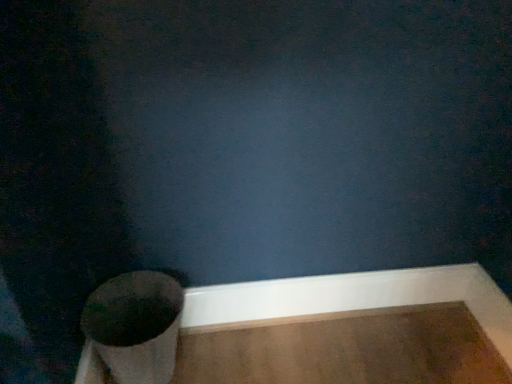
What is the approximate height of white smooth baseboard at lower right?

It is 5.93 inches.

The width and height of the screenshot is (512, 384). What do you see at coordinates (352, 296) in the screenshot? I see `white smooth baseboard at lower right` at bounding box center [352, 296].

Identify the location of white smooth baseboard at lower right. Image resolution: width=512 pixels, height=384 pixels. (352, 296).

The width and height of the screenshot is (512, 384). In order to click on matte black toilet at lower left in this screenshot , I will do `click(136, 325)`.

Describe the element at coordinates (136, 325) in the screenshot. This screenshot has height=384, width=512. I see `matte black toilet at lower left` at that location.

This screenshot has height=384, width=512. Identify the location of white smooth baseboard at lower right. (352, 296).

In the image, is white smooth baseboard at lower right on the left side or the right side of matte black toilet at lower left?

white smooth baseboard at lower right is positioned on matte black toilet at lower left's right side.

Which is in front, white smooth baseboard at lower right or matte black toilet at lower left?

matte black toilet at lower left.

Considering the positions of point (481, 323) and point (113, 356), is point (481, 323) closer or farther from the camera than point (113, 356)?

Point (481, 323) appears to be farther away from the viewer than point (113, 356).

From the image's perspective, does white smooth baseboard at lower right appear lower than matte black toilet at lower left?

Actually, white smooth baseboard at lower right appears above matte black toilet at lower left in the image.

From a real-world perspective, relative to matte black toilet at lower left, is white smooth baseboard at lower right vertically above or below?

white smooth baseboard at lower right is below matte black toilet at lower left.

Does white smooth baseboard at lower right have a lesser width compared to matte black toilet at lower left?

Indeed, white smooth baseboard at lower right has a lesser width compared to matte black toilet at lower left.

Considering the relative sizes of white smooth baseboard at lower right and matte black toilet at lower left in the image provided, is white smooth baseboard at lower right taller than matte black toilet at lower left?

No, white smooth baseboard at lower right is not taller than matte black toilet at lower left.

In terms of size, does white smooth baseboard at lower right appear bigger or smaller than matte black toilet at lower left?

Considering their sizes, white smooth baseboard at lower right takes up less space than matte black toilet at lower left.

Is white smooth baseboard at lower right inside or outside of matte black toilet at lower left?

white smooth baseboard at lower right is not inside matte black toilet at lower left, it's outside.

Are white smooth baseboard at lower right and matte black toilet at lower left located far from each other?

No, white smooth baseboard at lower right is not far from matte black toilet at lower left.

Is white smooth baseboard at lower right positioned with its back to matte black toilet at lower left?

No.

How many degrees apart are the facing directions of white smooth baseboard at lower right and matte black toilet at lower left?

The angular difference between white smooth baseboard at lower right and matte black toilet at lower left is 1.21 degrees.

Identify the location of molding above the matte black toilet at lower left (from the image's perspective). (352, 296).

Considering the relative positions of matte black toilet at lower left and white smooth baseboard at lower right in the image provided, is matte black toilet at lower left to the left of white smooth baseboard at lower right from the viewer's perspective?

Yes, matte black toilet at lower left is to the left of white smooth baseboard at lower right.

Considering the relative positions of matte black toilet at lower left and white smooth baseboard at lower right in the image provided, is matte black toilet at lower left in front of white smooth baseboard at lower right?

Yes, the depth of matte black toilet at lower left is less than that of white smooth baseboard at lower right.

Does point (93, 342) come in front of point (230, 305)?

Yes, point (93, 342) is closer to viewer.

Based on the photo, from the image's perspective, between matte black toilet at lower left and white smooth baseboard at lower right, which one is located above?

white smooth baseboard at lower right.

From a real-world perspective, is matte black toilet at lower left beneath white smooth baseboard at lower right?

Incorrect, from a real-world perspective, matte black toilet at lower left is higher than white smooth baseboard at lower right.

Which of these two, matte black toilet at lower left or white smooth baseboard at lower right, is thinner?

white smooth baseboard at lower right.

Can you confirm if matte black toilet at lower left is shorter than white smooth baseboard at lower right?

Incorrect, the height of matte black toilet at lower left does not fall short of that of white smooth baseboard at lower right.

Who is bigger, matte black toilet at lower left or white smooth baseboard at lower right?

matte black toilet at lower left is bigger.

Is white smooth baseboard at lower right completely or partially inside matte black toilet at lower left?

No, white smooth baseboard at lower right is not surrounded by matte black toilet at lower left.

Is matte black toilet at lower left next to white smooth baseboard at lower right?

matte black toilet at lower left and white smooth baseboard at lower right are not in contact.

Could you tell me if matte black toilet at lower left is facing white smooth baseboard at lower right?

No, matte black toilet at lower left is not oriented towards white smooth baseboard at lower right.

What's the angular difference between matte black toilet at lower left and white smooth baseboard at lower right's facing directions?

They differ by 1.21 degrees in their facing directions.

This screenshot has width=512, height=384. Identify the location of molding that is behind the matte black toilet at lower left. (352, 296).

The width and height of the screenshot is (512, 384). What are the coordinates of `molding above the matte black toilet at lower left (from the image's perspective)` in the screenshot? It's located at (352, 296).

Identify the location of toilet on the left of white smooth baseboard at lower right. Image resolution: width=512 pixels, height=384 pixels. (136, 325).